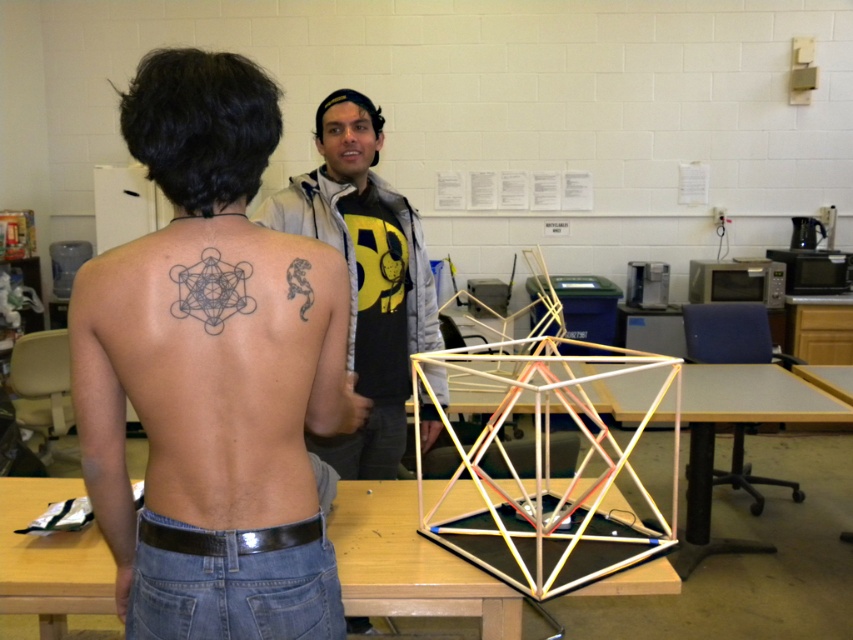
Question: Can you confirm if black ink tattoo at upper center is thinner than black ink lizard at upper back?

Choices:
 (A) no
 (B) yes

Answer: (A)

Question: From the image, what is the correct spatial relationship of black ink tattoo at upper center in relation to wooden table at center?

Choices:
 (A) right
 (B) left

Answer: (B)

Question: Estimate the real-world distances between objects in this image. Which object is farther from the black ink lizard at upper back?

Choices:
 (A) black ink tattoo at upper center
 (B) black ink tattoo at upper left

Answer: (A)

Question: Is wooden table at center further to the viewer compared to black ink lizard at upper back?

Choices:
 (A) yes
 (B) no

Answer: (A)

Question: Which of the following is the closest to the observer?

Choices:
 (A) black ink tattoo at upper left
 (B) black ink tattoo at upper center
 (C) white plastic table at center
 (D) black skin tattoo at upper center

Answer: (B)

Question: Which object appears closest to the camera in this image?

Choices:
 (A) black skin tattoo at upper center
 (B) black ink lizard at upper back

Answer: (A)